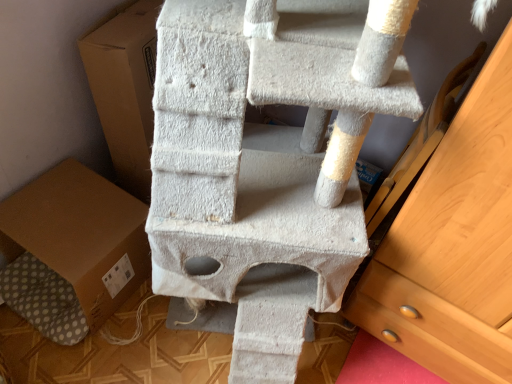
Question: In the image, is wooden chest of drawers at right positioned in front of or behind brown cardboard box at lower left?

Choices:
 (A) front
 (B) behind

Answer: (A)

Question: Is wooden chest of drawers at right taller or shorter than brown cardboard box at lower left?

Choices:
 (A) short
 (B) tall

Answer: (B)

Question: Does point (481, 311) appear closer or farther from the camera than point (31, 238)?

Choices:
 (A) farther
 (B) closer

Answer: (B)

Question: Relative to wooden chest of drawers at right, is brown cardboard box at lower left in front or behind?

Choices:
 (A) behind
 (B) front

Answer: (A)

Question: In terms of height, does brown cardboard box at lower left look taller or shorter compared to wooden chest of drawers at right?

Choices:
 (A) tall
 (B) short

Answer: (B)

Question: Do you think brown cardboard box at lower left is within wooden chest of drawers at right, or outside of it?

Choices:
 (A) inside
 (B) outside

Answer: (B)

Question: From the image's perspective, is brown cardboard box at lower left above or below wooden chest of drawers at right?

Choices:
 (A) below
 (B) above

Answer: (A)